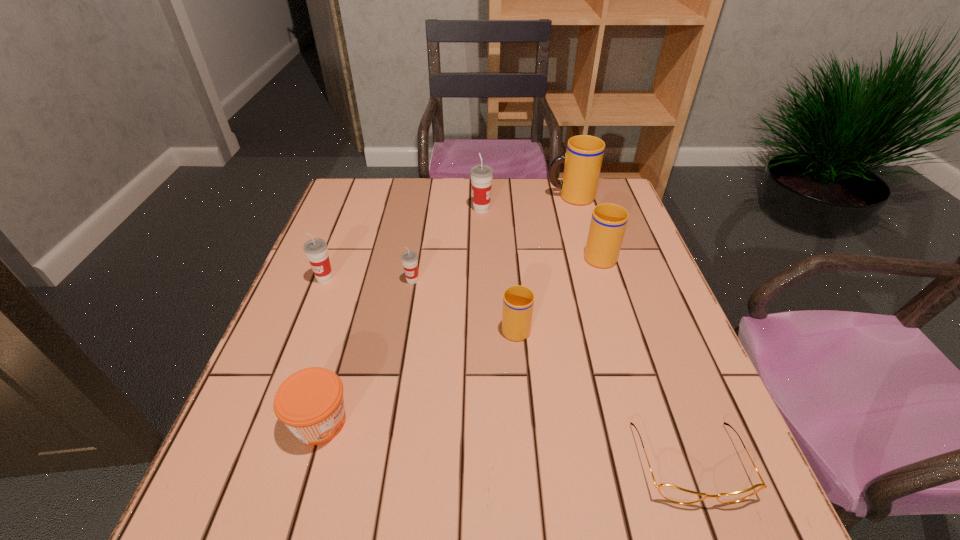
At what (x,y) coordinates should I click in order to perform the action: click on blank region between the biggest beige cup and the leftmost beige cup. Please return your answer as a coordinate pair (x, y). This screenshot has width=960, height=540. Looking at the image, I should click on (543, 261).

Select which object is the seventh closest to the leftmost beige cup. Please provide its 2D coordinates. Your answer should be formatted as a tuple, i.e. [(x, y)], where the tuple contains the x and y coordinates of a point satisfying the conditions above.

[(582, 161)]

Where is `object that is the fourth closest to the farthest beige cup`? object that is the fourth closest to the farthest beige cup is located at coordinates (409, 258).

Where is `cup that stands as the third closest to the leftmost cup`? This screenshot has height=540, width=960. cup that stands as the third closest to the leftmost cup is located at coordinates (481, 174).

Choose which cup is the fourth nearest neighbor to the jam. Please provide its 2D coordinates. Your answer should be formatted as a tuple, i.e. [(x, y)], where the tuple contains the x and y coordinates of a point satisfying the conditions above.

[(608, 222)]

Identify which beige cup is the second nearest to the farthest red cup. Please provide its 2D coordinates. Your answer should be formatted as a tuple, i.e. [(x, y)], where the tuple contains the x and y coordinates of a point satisfying the conditions above.

[(608, 222)]

What are the coordinates of `beige cup that stands as the second closest to the smallest red cup` in the screenshot? It's located at (608, 222).

This screenshot has width=960, height=540. Find the location of `the second closest red cup to the biggest red cup`. the second closest red cup to the biggest red cup is located at coordinates (316, 250).

Point out which red cup is positioned as the nearest to the smallest red cup. Please provide its 2D coordinates. Your answer should be formatted as a tuple, i.e. [(x, y)], where the tuple contains the x and y coordinates of a point satisfying the conditions above.

[(316, 250)]

Locate an element on the screen. This screenshot has width=960, height=540. free location that satisfies the following two spatial constraints: 1. on the side of the nearest cup with the handle; 2. on the side of the farthest beige cup with the handle is located at coordinates (505, 197).